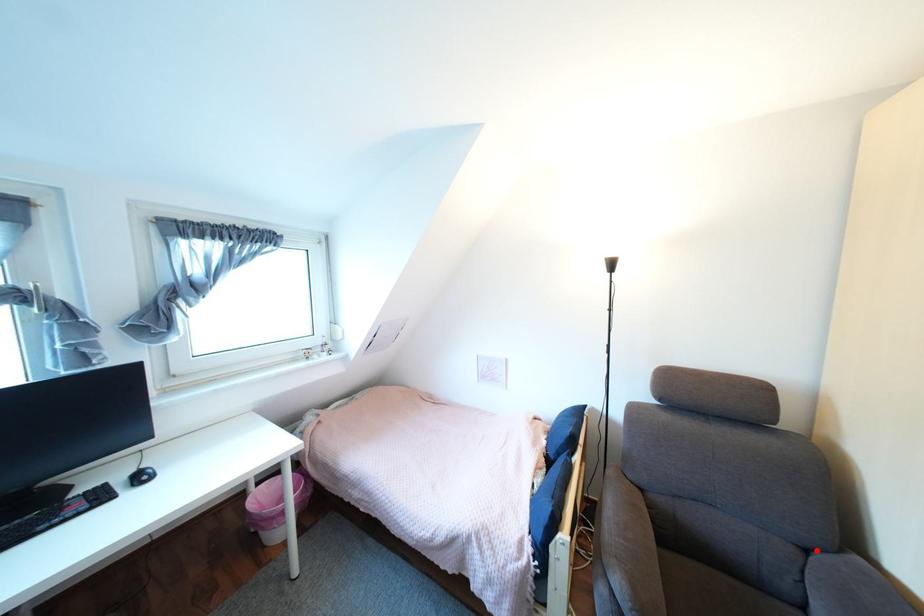
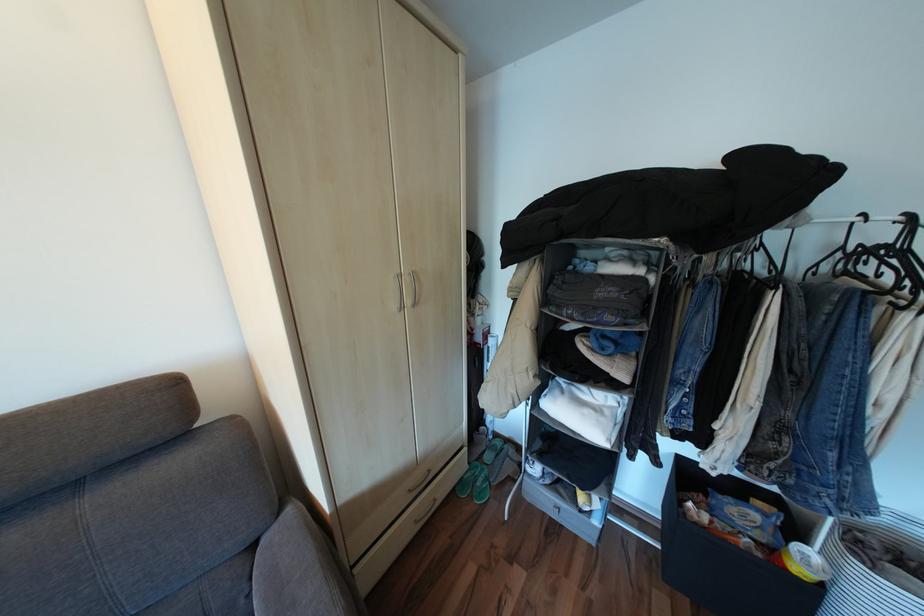
Find the pixel in the second image that matches the highlighted location in the first image.

(263, 545)